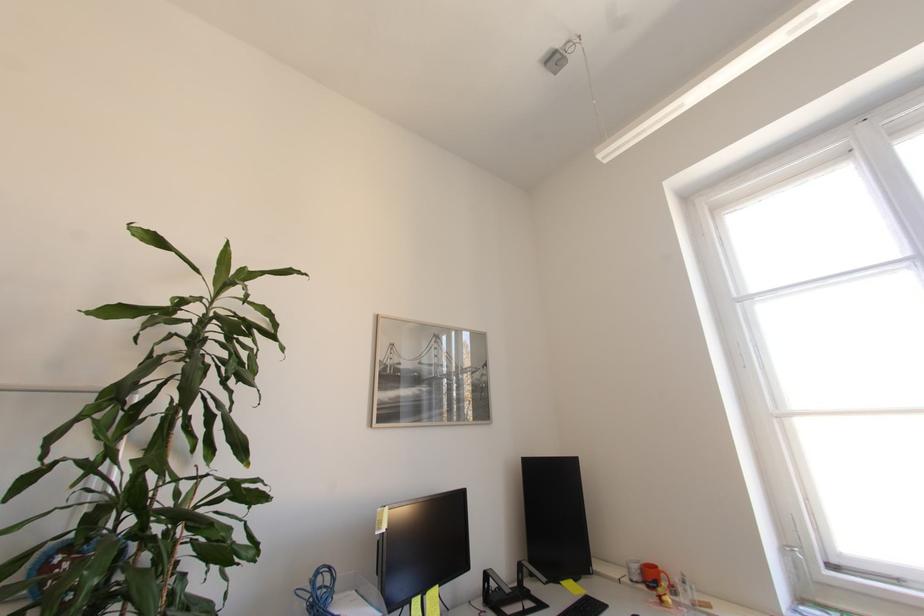
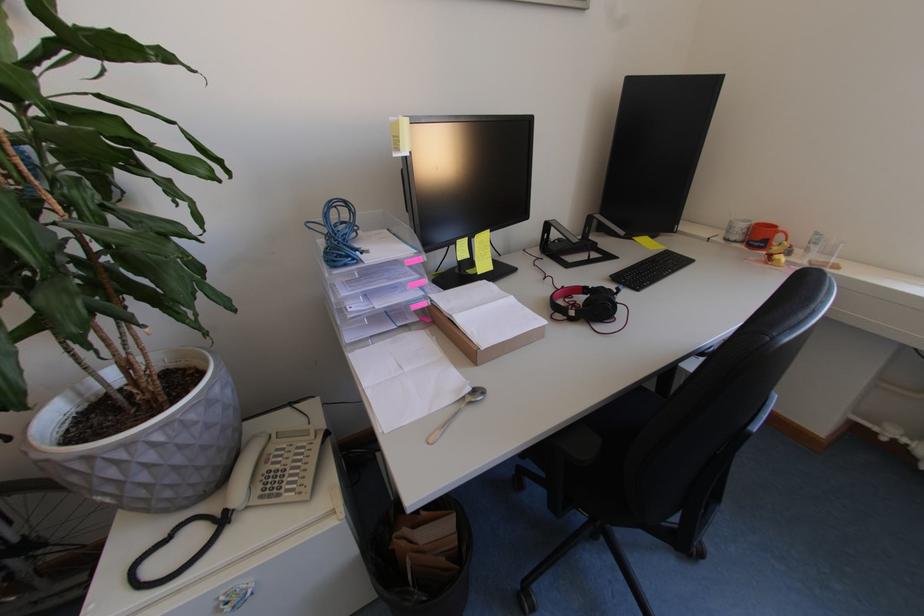
In the second image, find the point that corresponds to point (671, 578) in the first image.

(786, 238)